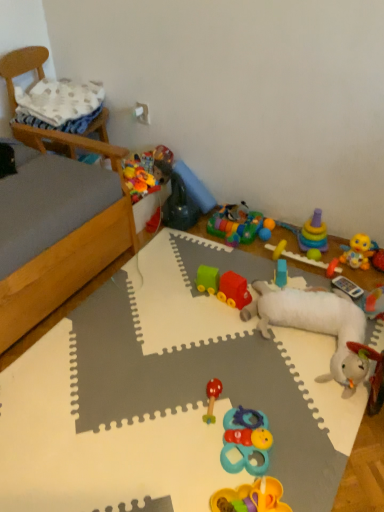
The height and width of the screenshot is (512, 384). Find the location of `free space behind blue plastic toy at center, which appears as the fifth toy when ordered from the bottom`. free space behind blue plastic toy at center, which appears as the fifth toy when ordered from the bottom is located at coordinates (267, 262).